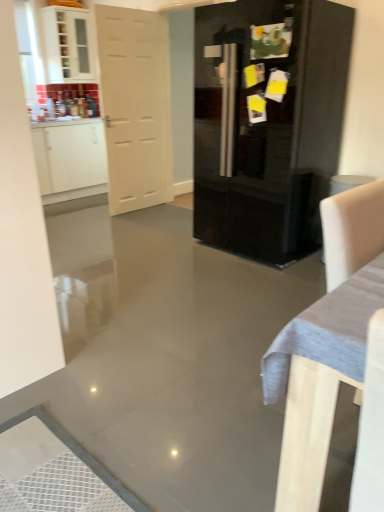
Question: Does glossy black refrigerator at center have a greater width compared to white matte door at left?

Choices:
 (A) yes
 (B) no

Answer: (A)

Question: Is glossy black refrigerator at center next to white matte door at left and touching it?

Choices:
 (A) no
 (B) yes

Answer: (A)

Question: From a real-world perspective, is glossy black refrigerator at center physically above white matte door at left?

Choices:
 (A) no
 (B) yes

Answer: (A)

Question: Can you confirm if glossy black refrigerator at center is bigger than white matte door at left?

Choices:
 (A) yes
 (B) no

Answer: (A)

Question: Is glossy black refrigerator at center outside of white matte door at left?

Choices:
 (A) yes
 (B) no

Answer: (A)

Question: From a real-world perspective, relative to white fabric armchair at right, is white glossy cabinet at upper left, positioned as the 1th cabinetry in top-to-bottom order, vertically above or below?

Choices:
 (A) above
 (B) below

Answer: (A)

Question: Is white glossy cabinet at upper left, positioned as the 1th cabinetry in top-to-bottom order, taller or shorter than white fabric armchair at right?

Choices:
 (A) short
 (B) tall

Answer: (B)

Question: Considering the relative positions of white glossy cabinet at upper left, positioned as the 1th cabinetry in top-to-bottom order, and white fabric armchair at right in the image provided, is white glossy cabinet at upper left, positioned as the 1th cabinetry in top-to-bottom order, to the left or to the right of white fabric armchair at right?

Choices:
 (A) right
 (B) left

Answer: (B)

Question: Is white glossy cabinet at upper left, positioned as the second cabinetry in bottom-to-top order, in front of or behind white fabric armchair at right in the image?

Choices:
 (A) front
 (B) behind

Answer: (B)

Question: Considering their positions, is white matte door at left located in front of or behind white fabric armchair at right?

Choices:
 (A) behind
 (B) front

Answer: (A)

Question: From the image's perspective, relative to white fabric armchair at right, is white matte door at left above or below?

Choices:
 (A) above
 (B) below

Answer: (A)

Question: Visually, is white matte door at left positioned to the left or to the right of white fabric armchair at right?

Choices:
 (A) left
 (B) right

Answer: (A)

Question: Considering the positions of white matte door at left and white fabric armchair at right in the image, is white matte door at left wider or thinner than white fabric armchair at right?

Choices:
 (A) thin
 (B) wide

Answer: (A)

Question: Choose the correct answer: Is glossy black refrigerator at center inside white matte door at left or outside it?

Choices:
 (A) inside
 (B) outside

Answer: (B)

Question: Would you say glossy black refrigerator at center is to the left or to the right of white matte door at left in the picture?

Choices:
 (A) right
 (B) left

Answer: (A)